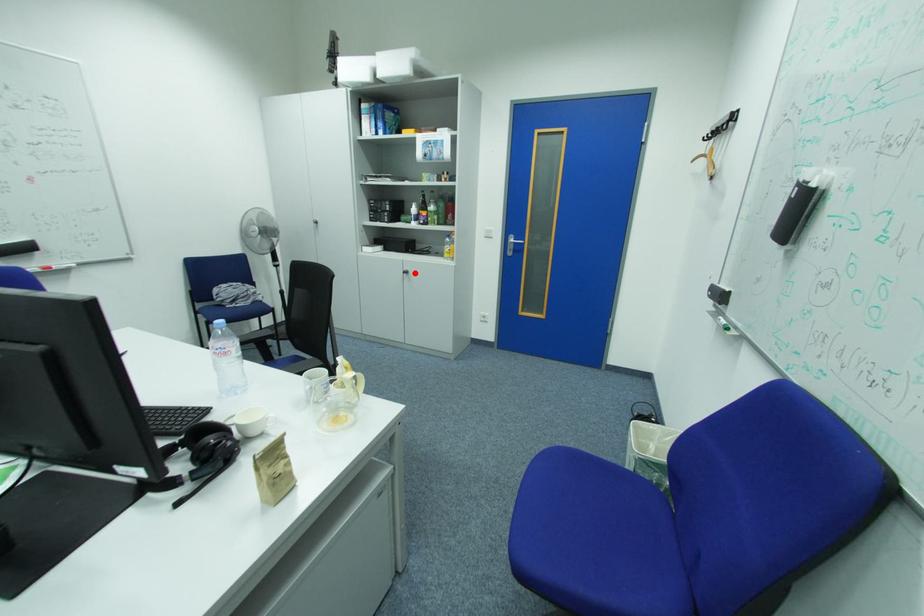
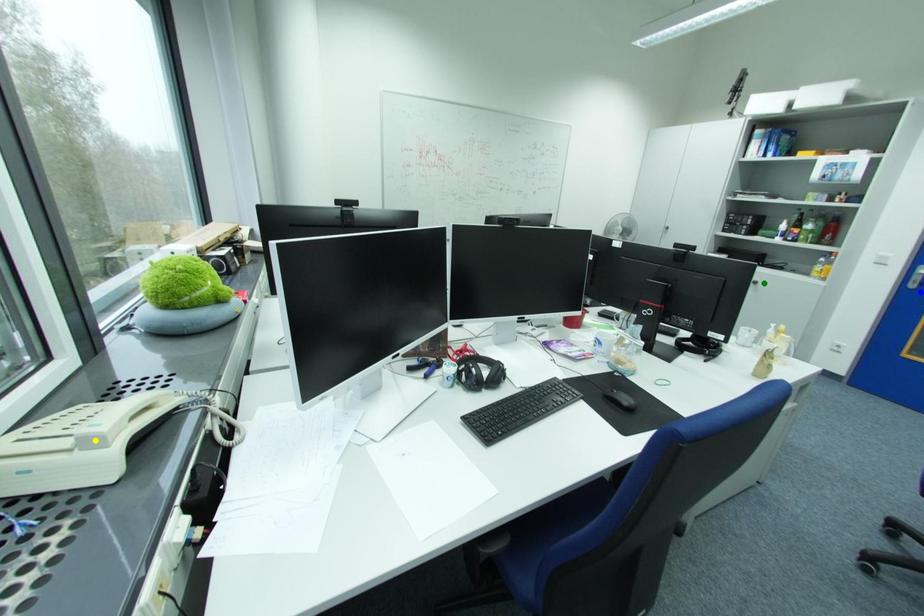
Question: I am providing you with two images of the same scene from different viewpoints. A red point is marked on the first image. You are given multiple points on the second image. Which point in image 2 is actually the same real-world point as the red point in image 1?

Choices:
 (A) yellow point
 (B) blue point
 (C) green point

Answer: (C)